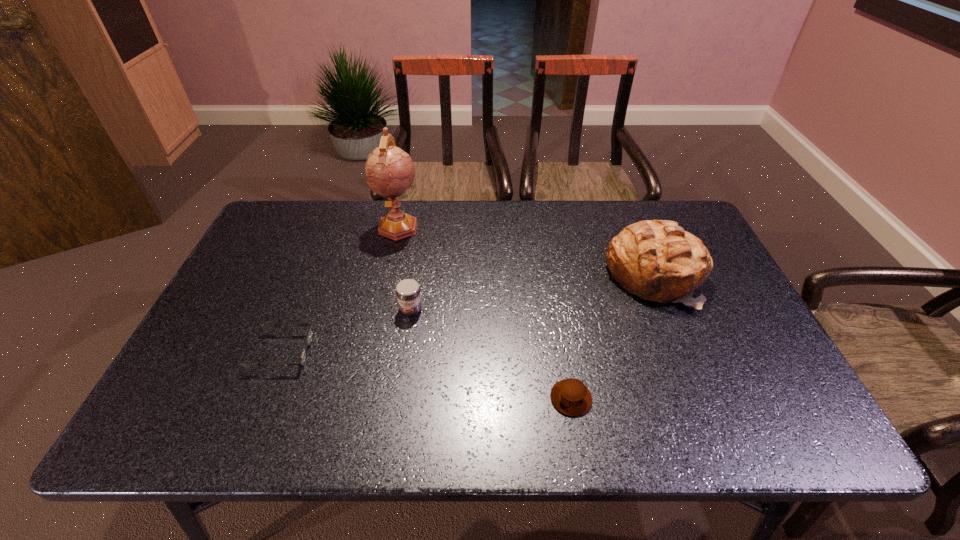
Where is `empty space that is in between the fourth object from left to right and the second tallest object`? The width and height of the screenshot is (960, 540). empty space that is in between the fourth object from left to right and the second tallest object is located at coordinates (612, 337).

Locate an element on the screen. vacant area that lies between the fourth shortest object and the tallest object is located at coordinates (526, 251).

Where is `free spot between the jam and the second shortest object`? The image size is (960, 540). free spot between the jam and the second shortest object is located at coordinates (491, 354).

The width and height of the screenshot is (960, 540). Identify the location of blank region between the nearest object and the third tallest object. (491, 354).

At what (x,y) coordinates should I click in order to perform the action: click on vacant point located between the fourth tallest object and the jam. Please return your answer as a coordinate pair (x, y). The width and height of the screenshot is (960, 540). Looking at the image, I should click on coord(491,354).

This screenshot has height=540, width=960. I want to click on object that is the fourth closest to the leftmost object, so 657,260.

The width and height of the screenshot is (960, 540). Find the location of `object that is the third closest to the third shortest object`. object that is the third closest to the third shortest object is located at coordinates coord(570,396).

Find the location of a particular element. The width and height of the screenshot is (960, 540). free space that satisfies the following two spatial constraints: 1. on the temples of the muffin; 2. on the right side of the second nearest object is located at coordinates (265, 398).

The height and width of the screenshot is (540, 960). Identify the location of free space that satisfies the following two spatial constraints: 1. on the front side of the fourth shortest object; 2. on the temples of the leftmost object. (684, 352).

The width and height of the screenshot is (960, 540). Identify the location of vacant space that satisfies the following two spatial constraints: 1. on the temples of the second nearest object; 2. on the right side of the muffin. (265, 398).